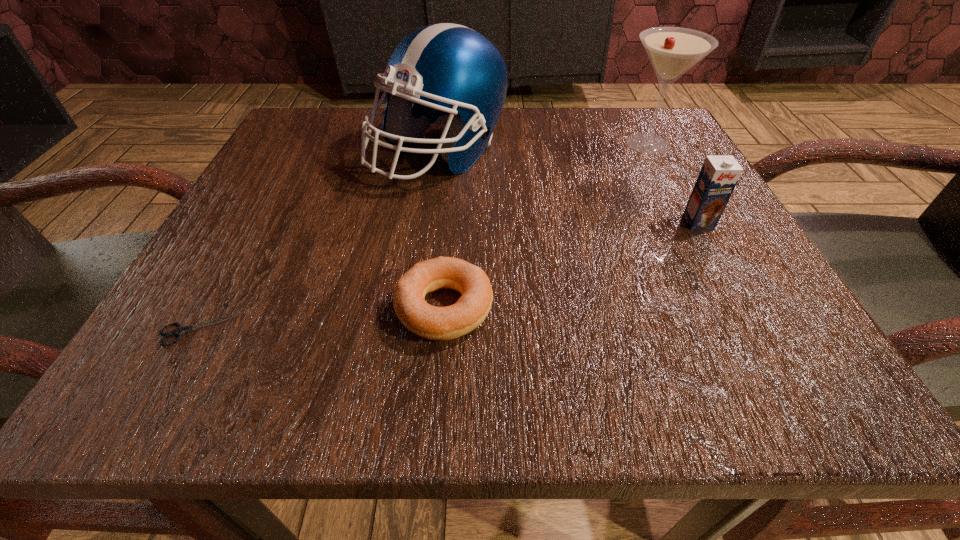
This screenshot has width=960, height=540. Find the location of `free spot that satisfies the following two spatial constraints: 1. on the back side of the second shortest object; 2. on the right side of the martini`. free spot that satisfies the following two spatial constraints: 1. on the back side of the second shortest object; 2. on the right side of the martini is located at coordinates (456, 144).